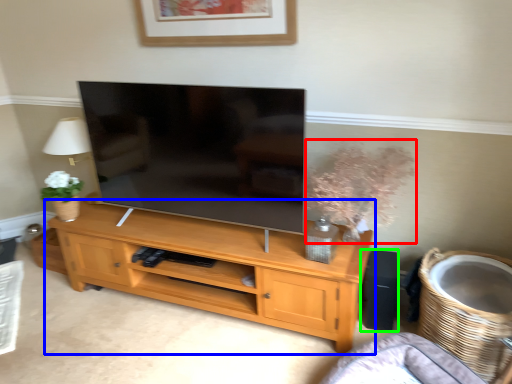
Question: Considering the real-world distances, which object is closest to floral arrangement (highlighted by a red box)? shelf (highlighted by a blue box) or speaker (highlighted by a green box).

Choices:
 (A) shelf
 (B) speaker

Answer: (B)